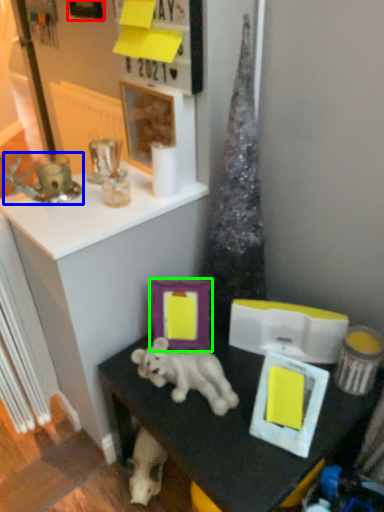
Question: Which is nearer to the picture frame (highlighted by a red box)? candle holder (highlighted by a blue box) or picture frame (highlighted by a green box).

Choices:
 (A) candle holder
 (B) picture frame

Answer: (A)